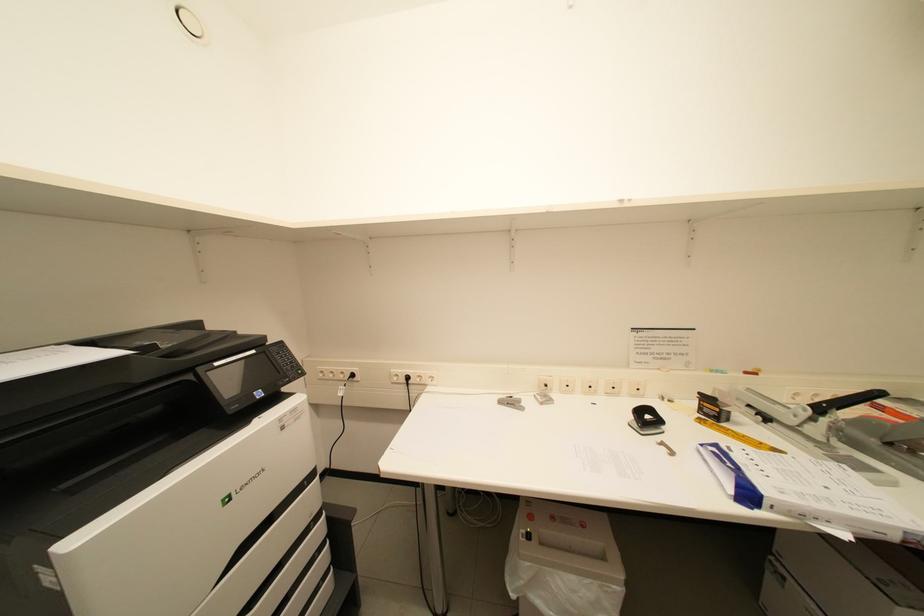
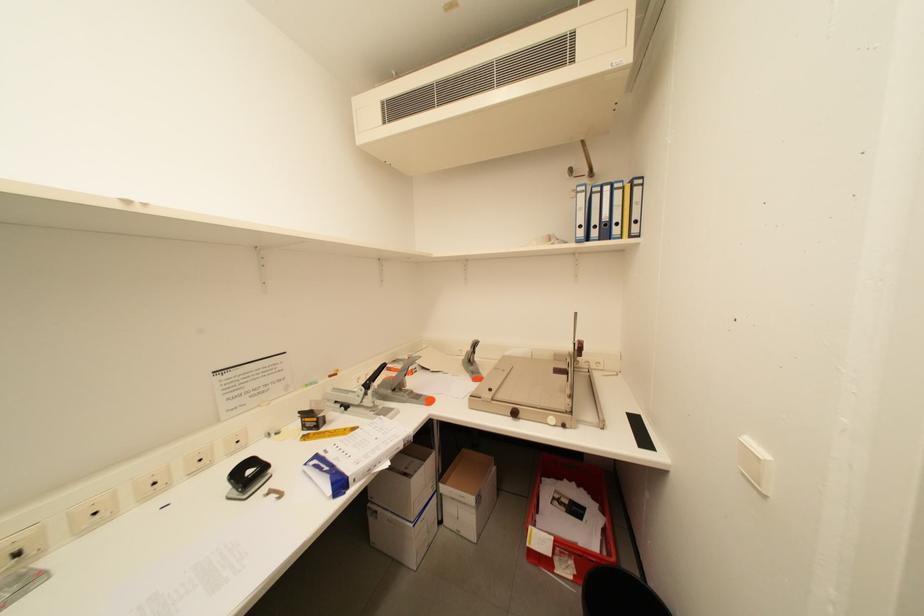
Question: The camera is either moving clockwise (left) or counter-clockwise (right) around the object. The first image is from the beginning of the video and the second image is from the end. Is the camera moving left or right when shooting the video?

Choices:
 (A) Left
 (B) Right

Answer: (A)